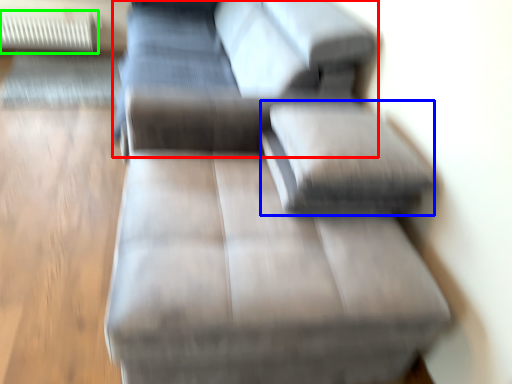
Question: Estimate the real-world distances between objects in this image. Which object is farther from couch (highlighted by a red box), pillow (highlighted by a blue box) or radiator (highlighted by a green box)?

Choices:
 (A) pillow
 (B) radiator

Answer: (B)